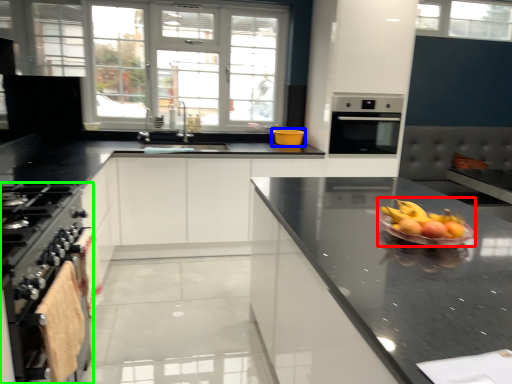
Question: Which is nearer to the fruit salad (highlighted by a red box)? glass bowl (highlighted by a blue box) or kitchen appliance (highlighted by a green box).

Choices:
 (A) glass bowl
 (B) kitchen appliance

Answer: (B)